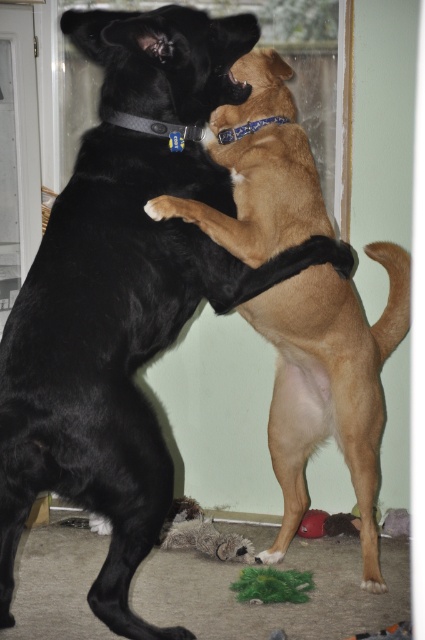
Who is more forward, (282, 465) or (17, 140)?

Point (282, 465)

Who is more distant from viewer, (285, 280) or (0, 321)?

Positioned behind is point (0, 321).

Where is `brown furry dog at center`? brown furry dog at center is located at coordinates (329, 385).